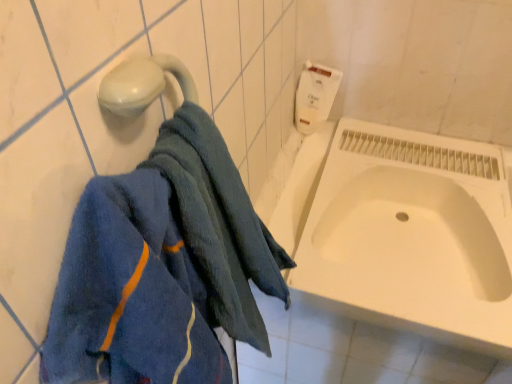
Describe the element at coordinates (315, 96) in the screenshot. The width and height of the screenshot is (512, 384). I see `white matte toilet paper at upper right` at that location.

What is the approximate width of blue soft towel at left?

It is 5.87 inches.

Locate an element on the screen. This screenshot has width=512, height=384. white glossy bathtub at center is located at coordinates (402, 232).

Is there a large distance between white glossy bathtub at center and white matte toilet paper at upper right?

They are positioned close to each other.

Between white glossy bathtub at center and white matte toilet paper at upper right, which one is positioned behind?

white matte toilet paper at upper right is behind.

From a real-world perspective, which is physically below, white glossy bathtub at center or white matte toilet paper at upper right?

From a 3D spatial view, white glossy bathtub at center is below.

Considering the sizes of objects white glossy bathtub at center and white matte toilet paper at upper right in the image provided, who is taller, white glossy bathtub at center or white matte toilet paper at upper right?

With more height is white matte toilet paper at upper right.

From the image's perspective, is white matte toilet paper at upper right below white glossy bathtub at center?

No, from the image's perspective, white matte toilet paper at upper right is not beneath white glossy bathtub at center.

Between white matte toilet paper at upper right and white glossy bathtub at center, which one appears on the left side from the viewer's perspective?

white matte toilet paper at upper right is more to the left.

Is white matte toilet paper at upper right aimed at white glossy bathtub at center?

No.

Considering the points (318, 68) and (360, 168), which point is behind, point (318, 68) or point (360, 168)?

Point (318, 68)

Is white glossy bathtub at center positioned with its back to blue soft towel at left?

white glossy bathtub at center is not turned away from blue soft towel at left.

From the image's perspective, is white glossy bathtub at center positioned above or below blue soft towel at left?

white glossy bathtub at center is above blue soft towel at left.

Considering the relative positions of white glossy bathtub at center and blue soft towel at left in the image provided, is white glossy bathtub at center to the left or to the right of blue soft towel at left?

In the image, white glossy bathtub at center appears on the right side of blue soft towel at left.

From the picture: Choose the correct answer: Is white glossy bathtub at center inside blue soft towel at left or outside it?

white glossy bathtub at center is located beyond the bounds of blue soft towel at left.

At what (x,y) coordinates should I click in order to perform the action: click on bath behind the blue soft towel at left. Please return your answer as a coordinate pair (x, y). Looking at the image, I should click on (402, 232).

Is blue soft towel at left not near white glossy bathtub at center?

No, blue soft towel at left is in close proximity to white glossy bathtub at center.

Which object is positioned more to the left, blue soft towel at left or white glossy bathtub at center?

Positioned to the left is blue soft towel at left.

Is point (99, 346) closer or farther from the camera than point (419, 177)?

Point (99, 346) is closer to the camera than point (419, 177).

Does white matte toilet paper at upper right appear on the left side of blue soft towel at left?

No.

Is blue soft towel at left surrounded by white matte toilet paper at upper right?

No, blue soft towel at left is not inside white matte toilet paper at upper right.

From the image's perspective, is white matte toilet paper at upper right under blue soft towel at left?

Actually, white matte toilet paper at upper right appears above blue soft towel at left in the image.

Is white matte toilet paper at upper right oriented towards blue soft towel at left?

Yes, white matte toilet paper at upper right faces towards blue soft towel at left.

From the image's perspective, who appears lower, blue soft towel at left or white matte toilet paper at upper right?

blue soft towel at left is shown below in the image.

From a real-world perspective, is blue soft towel at left located beneath white matte toilet paper at upper right?

No, from a real-world perspective, blue soft towel at left is not under white matte toilet paper at upper right.

Between blue soft towel at left and white matte toilet paper at upper right, which one has larger width?

blue soft towel at left is wider.

Image resolution: width=512 pixels, height=384 pixels. I want to click on toilet paper that is behind the blue soft towel at left, so click(x=315, y=96).

Where is `bath on the right of the white matte toilet paper at upper right`? bath on the right of the white matte toilet paper at upper right is located at coordinates (402, 232).

Identify the location of bath below the white matte toilet paper at upper right (from the image's perspective). (402, 232).

Based on their spatial positions, is white glossy bathtub at center or white matte toilet paper at upper right closer to blue soft towel at left?

Based on the image, white glossy bathtub at center appears to be nearer to blue soft towel at left.

Based on their spatial positions, is white matte toilet paper at upper right or blue soft towel at left closer to white glossy bathtub at center?

white matte toilet paper at upper right is positioned closer to the anchor white glossy bathtub at center.

Estimate the real-world distances between objects in this image. Which object is further from white matte toilet paper at upper right, white glossy bathtub at center or blue soft towel at left?

blue soft towel at left is further to white matte toilet paper at upper right.

When comparing their distances from blue soft towel at left, does white matte toilet paper at upper right or white glossy bathtub at center seem closer?

Among the two, white glossy bathtub at center is located nearer to blue soft towel at left.

Based on their spatial positions, is blue soft towel at left or white glossy bathtub at center closer to white matte toilet paper at upper right?

white glossy bathtub at center is closer to white matte toilet paper at upper right.

Estimate the real-world distances between objects in this image. Which object is closer to white glossy bathtub at center, blue soft towel at left or white matte toilet paper at upper right?

white matte toilet paper at upper right is closer to white glossy bathtub at center.

Locate an element on the screen. bath between blue soft towel at left and white matte toilet paper at upper right in the front-back direction is located at coordinates (402, 232).